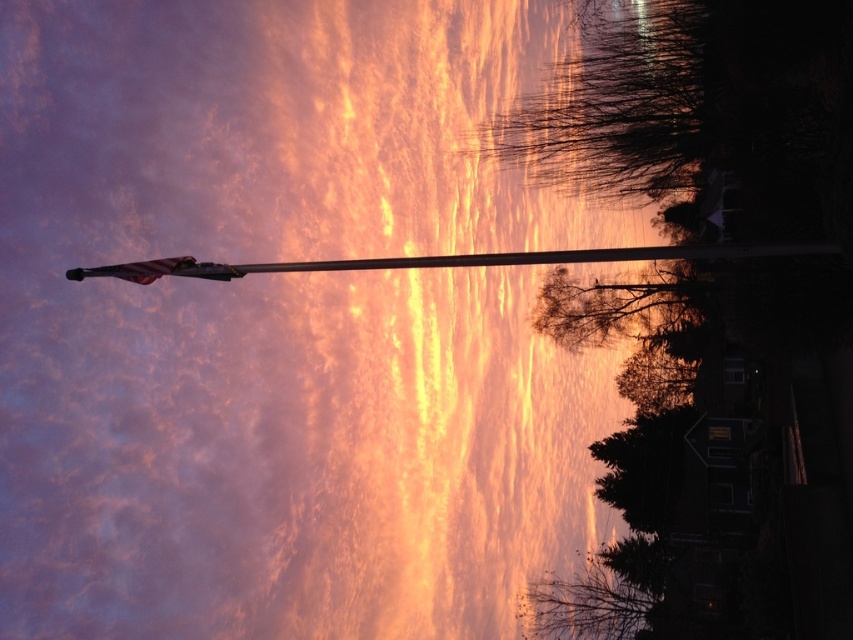
Question: Is metallic flag pole at center bigger than american flag at upper left?

Choices:
 (A) yes
 (B) no

Answer: (A)

Question: Which object is farther from the camera taking this photo?

Choices:
 (A) american flag at upper left
 (B) metallic flag pole at center

Answer: (A)

Question: Among these objects, which one is nearest to the camera?

Choices:
 (A) american flag at upper left
 (B) metallic flag pole at center

Answer: (B)

Question: Does metallic flag pole at center have a greater width compared to american flag at upper left?

Choices:
 (A) yes
 (B) no

Answer: (A)

Question: Which point is farther from the camera taking this photo?

Choices:
 (A) (390, 262)
 (B) (80, 276)

Answer: (B)

Question: Does metallic flag pole at center lie behind american flag at upper left?

Choices:
 (A) no
 (B) yes

Answer: (A)